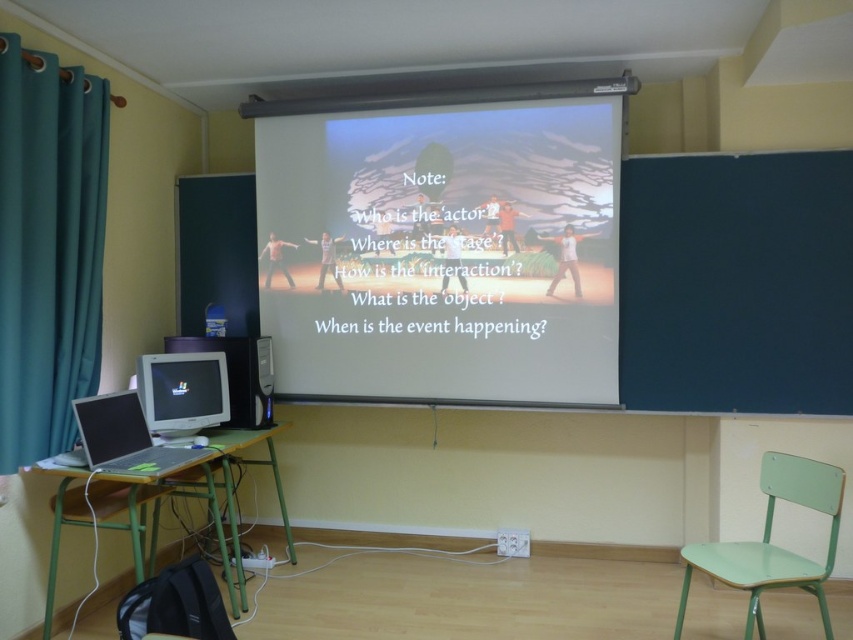
Between white matte projection screen at center and green matte chair at lower right, which one has less height?

Standing shorter between the two is green matte chair at lower right.

Between white matte projection screen at center and green matte chair at lower right, which one is positioned higher?

Positioned higher is white matte projection screen at center.

Where is `white matte projection screen at center`? white matte projection screen at center is located at coordinates pyautogui.click(x=444, y=252).

How much distance is there between teal fabric curtain at left and green plastic table at lower left?

The distance of teal fabric curtain at left from green plastic table at lower left is 31.64 inches.

Which is more to the left, teal fabric curtain at left or green plastic table at lower left?

teal fabric curtain at left

Where is `teal fabric curtain at left`? This screenshot has width=853, height=640. teal fabric curtain at left is located at coordinates (48, 248).

I want to click on teal fabric curtain at left, so click(48, 248).

Which is in front, point (689, 566) or point (206, 364)?

Point (689, 566) is more forward.

Can you confirm if green matte chair at lower right is smaller than matte plastic monitor at lower left?

Actually, green matte chair at lower right might be larger than matte plastic monitor at lower left.

Which is in front, point (776, 566) or point (166, 371)?

Point (776, 566) is more forward.

Locate an element on the screen. green matte chair at lower right is located at coordinates (772, 545).